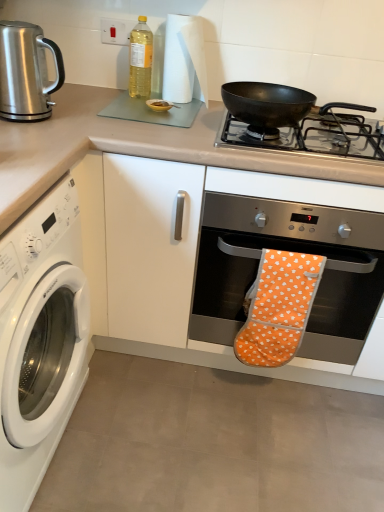
Question: In terms of size, does white glossy washing machine at left appear bigger or smaller than orange fabric oven mitt at center?

Choices:
 (A) small
 (B) big

Answer: (B)

Question: Does point (69, 263) appear closer or farther from the camera than point (274, 310)?

Choices:
 (A) closer
 (B) farther

Answer: (A)

Question: Estimate the real-world distances between objects in this image. Which object is closer to the matte glass cutting board at upper center?

Choices:
 (A) polished stainless steel kettle at upper left
 (B) transparent plastic bottle at upper center
 (C) orange fabric oven mitt at center
 (D) white glossy washing machine at left
 (E) orange fabric oven mitt at center

Answer: (E)

Question: Which is nearer to the white glossy washing machine at left?

Choices:
 (A) transparent plastic bottle at upper center
 (B) black matte pan at upper right
 (C) orange fabric oven mitt at center
 (D) orange fabric oven mitt at center
 (E) polished stainless steel kettle at upper left

Answer: (E)